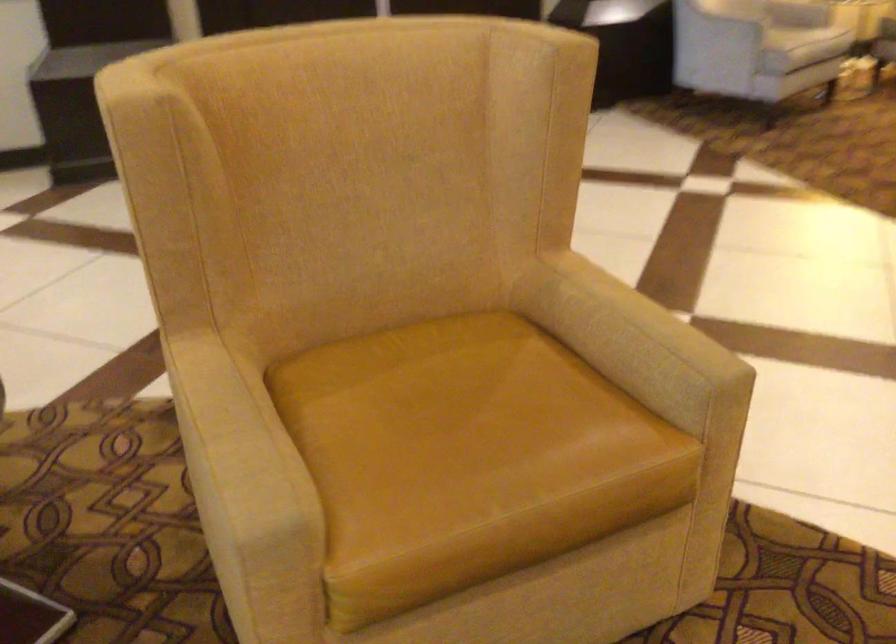
At what (x,y) coordinates should I click in order to perform the action: click on chair sitting surface. Please return your answer as a coordinate pair (x, y). The height and width of the screenshot is (644, 896). Looking at the image, I should click on (452, 426).